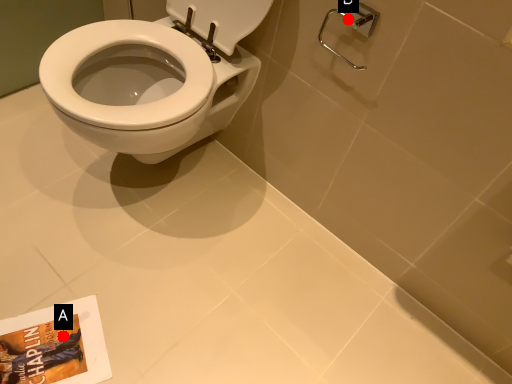
Question: Two points are circled on the image, labeled by A and B beside each circle. Which of the following is the closest to the observer?

Choices:
 (A) A is closer
 (B) B is closer

Answer: (B)